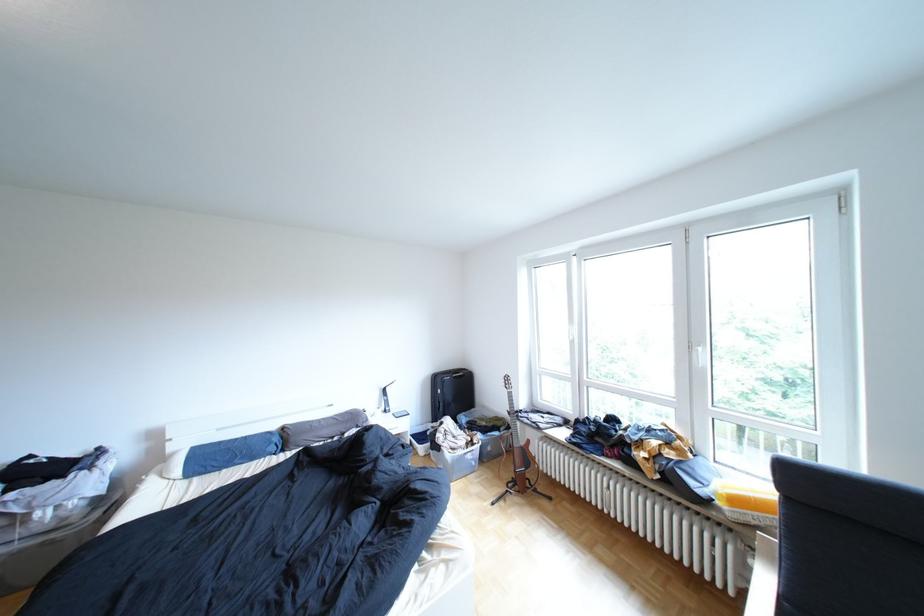
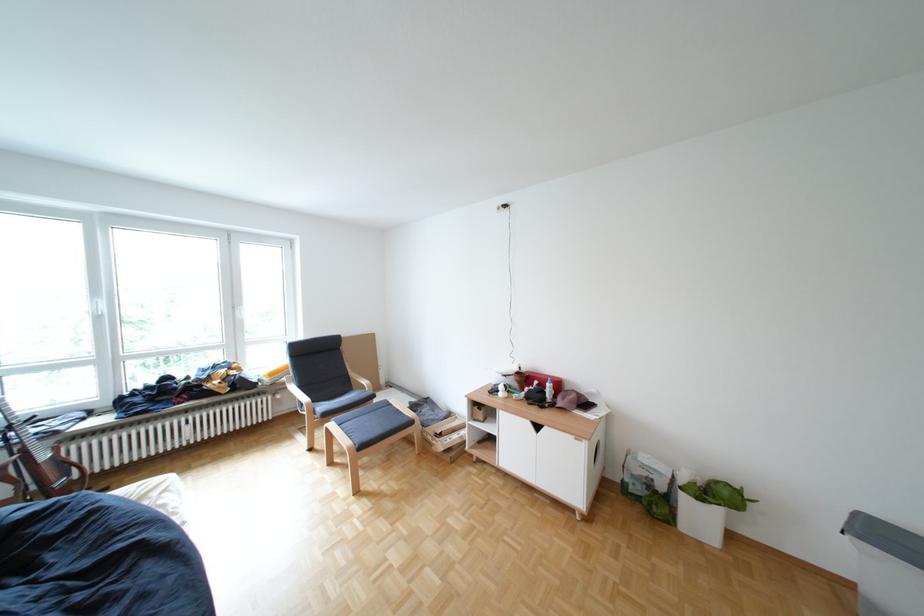
In the second image, find the point that corresponds to pixel 588 342 in the first image.

(114, 318)